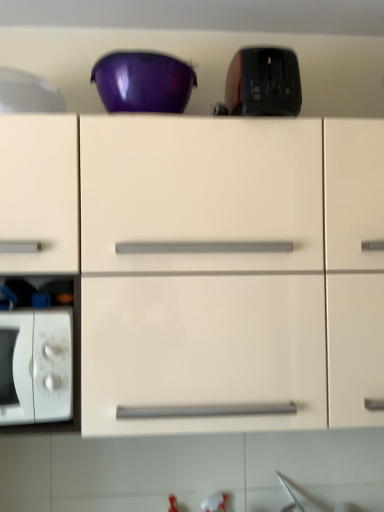
Describe the element at coordinates (230, 273) in the screenshot. I see `matte white cabinet at center` at that location.

Image resolution: width=384 pixels, height=512 pixels. What do you see at coordinates (143, 82) in the screenshot?
I see `glossy plastic bowl at upper center` at bounding box center [143, 82].

This screenshot has height=512, width=384. I want to click on white matte microwave oven at lower left, so coord(40,366).

At what (x,y) coordinates should I click in order to perform the action: click on black glossy toaster at upper center, the second appliance positioned from the left. Please return your answer as a coordinate pair (x, y). This screenshot has height=512, width=384. Looking at the image, I should click on (263, 83).

Is glossy plastic bowl at upper center at the back of black glossy toaster at upper center, which is the first appliance in right-to-left order?

No.

Considering the sizes of objects black glossy toaster at upper center, which is the first appliance in right-to-left order, and glossy plastic bowl at upper center in the image provided, who is wider, black glossy toaster at upper center, which is the first appliance in right-to-left order, or glossy plastic bowl at upper center?

glossy plastic bowl at upper center is wider.

Considering the sizes of objects black glossy toaster at upper center, the second appliance positioned from the left, and glossy plastic bowl at upper center in the image provided, who is taller, black glossy toaster at upper center, the second appliance positioned from the left, or glossy plastic bowl at upper center?

black glossy toaster at upper center, the second appliance positioned from the left, is taller.

Does black glossy toaster at upper center, the second appliance positioned from the left, lie behind glossy plastic bowl at upper center?

No, black glossy toaster at upper center, the second appliance positioned from the left, is closer to the viewer.

Is glossy plastic bowl at upper center positioned before matte white cabinet at center?

No, it is not.

Where is `bowl lying behind the matte white cabinet at center`? The height and width of the screenshot is (512, 384). bowl lying behind the matte white cabinet at center is located at coordinates (143, 82).

Is glossy plastic bowl at upper center directly adjacent to matte white cabinet at center?

No, glossy plastic bowl at upper center is not next to matte white cabinet at center.

Is matte white cabinet at center next to white matte microwave oven at lower left?

They are not placed beside each other.

Who is smaller, matte white cabinet at center or white matte microwave oven at lower left?

white matte microwave oven at lower left.

In the scene shown: Can you confirm if matte white cabinet at center is wider than white matte microwave oven at lower left?

Correct, the width of matte white cabinet at center exceeds that of white matte microwave oven at lower left.

Is matte white cabinet at center further to camera compared to white matte microwave oven at lower left?

No.

From a real-world perspective, is white glossy microwave at left, marked as the first appliance in a left-to-right arrangement, physically below glossy plastic bowl at upper center?

Actually, white glossy microwave at left, marked as the first appliance in a left-to-right arrangement, is physically above glossy plastic bowl at upper center in the real world.

The image size is (384, 512). In order to click on appliance above the glossy plastic bowl at upper center (from a real-world perspective) in this screenshot , I will do `click(28, 93)`.

Is the depth of white glossy microwave at left, marked as the first appliance in a left-to-right arrangement, greater than that of glossy plastic bowl at upper center?

Yes, white glossy microwave at left, marked as the first appliance in a left-to-right arrangement, is further from the camera.

Does point (56, 111) come farther from viewer compared to point (153, 67)?

No, (56, 111) is closer to viewer.

Identify the location of microwave oven located on the left of black glossy toaster at upper center, the second appliance positioned from the left. Image resolution: width=384 pixels, height=512 pixels. click(40, 366).

From a real-world perspective, is black glossy toaster at upper center, the second appliance positioned from the left, beneath white matte microwave oven at lower left?

Actually, black glossy toaster at upper center, the second appliance positioned from the left, is physically above white matte microwave oven at lower left in the real world.

Could you tell me if black glossy toaster at upper center, which is the first appliance in right-to-left order, is facing white matte microwave oven at lower left?

No, black glossy toaster at upper center, which is the first appliance in right-to-left order, is not facing towards white matte microwave oven at lower left.

Is black glossy toaster at upper center, which is the first appliance in right-to-left order, in front of or behind white matte microwave oven at lower left in the image?

In the image, black glossy toaster at upper center, which is the first appliance in right-to-left order, appears behind white matte microwave oven at lower left.

I want to click on cabinetry lying in front of the white matte microwave oven at lower left, so click(x=230, y=273).

In the scene shown: Could you tell me if white matte microwave oven at lower left is turned towards matte white cabinet at center?

Yes, white matte microwave oven at lower left is facing matte white cabinet at center.

In the scene shown: Which point is more distant from viewer, (57, 328) or (120, 328)?

Point (120, 328)

Are white matte microwave oven at lower left and matte white cabinet at center located far from each other?

No, there isn't a large distance between white matte microwave oven at lower left and matte white cabinet at center.

From a real-world perspective, does black glossy toaster at upper center, the second appliance positioned from the left, sit lower than matte white cabinet at center?

No, from a real-world perspective, black glossy toaster at upper center, the second appliance positioned from the left, is not below matte white cabinet at center.

Which object is further away from the camera, black glossy toaster at upper center, the second appliance positioned from the left, or matte white cabinet at center?

black glossy toaster at upper center, the second appliance positioned from the left, is further away from the camera.

Is black glossy toaster at upper center, the second appliance positioned from the left, located outside matte white cabinet at center?

Yes.

Is black glossy toaster at upper center, the second appliance positioned from the left, not near matte white cabinet at center?

black glossy toaster at upper center, the second appliance positioned from the left, is actually quite close to matte white cabinet at center.

Find the location of a particular element. The image size is (384, 512). bowl above the black glossy toaster at upper center, which is the first appliance in right-to-left order (from a real-world perspective) is located at coordinates (143, 82).

Find the location of a particular element. bowl located behind the matte white cabinet at center is located at coordinates (143, 82).

Based on their spatial positions, is matte white cabinet at center or white matte microwave oven at lower left closer to black glossy toaster at upper center, which is the first appliance in right-to-left order?

matte white cabinet at center is closer to black glossy toaster at upper center, which is the first appliance in right-to-left order.

Based on the photo, based on their spatial positions, is white glossy microwave at left, marked as the first appliance in a left-to-right arrangement, or matte white cabinet at center closer to glossy plastic bowl at upper center?

white glossy microwave at left, marked as the first appliance in a left-to-right arrangement.

From the image, which object appears to be farther from white glossy microwave at left, which is the 2th appliance from right to left, black glossy toaster at upper center, which is the first appliance in right-to-left order, or glossy plastic bowl at upper center?

Based on the image, black glossy toaster at upper center, which is the first appliance in right-to-left order, appears to be further to white glossy microwave at left, which is the 2th appliance from right to left.

Based on their spatial positions, is white glossy microwave at left, which is the 2th appliance from right to left, or matte white cabinet at center closer to white matte microwave oven at lower left?

matte white cabinet at center lies closer to white matte microwave oven at lower left than the other object.

Considering their positions, is white glossy microwave at left, which is the 2th appliance from right to left, positioned further to matte white cabinet at center than glossy plastic bowl at upper center?

Based on the image, white glossy microwave at left, which is the 2th appliance from right to left, appears to be further to matte white cabinet at center.

When comparing their distances from glossy plastic bowl at upper center, does black glossy toaster at upper center, the second appliance positioned from the left, or white glossy microwave at left, marked as the first appliance in a left-to-right arrangement, seem further?

The object further to glossy plastic bowl at upper center is black glossy toaster at upper center, the second appliance positioned from the left.

Which object lies further to the anchor point matte white cabinet at center, white matte microwave oven at lower left or black glossy toaster at upper center, which is the first appliance in right-to-left order?

black glossy toaster at upper center, which is the first appliance in right-to-left order, is further to matte white cabinet at center.

From the image, which object appears to be nearer to black glossy toaster at upper center, the second appliance positioned from the left, glossy plastic bowl at upper center or white glossy microwave at left, marked as the first appliance in a left-to-right arrangement?

glossy plastic bowl at upper center.

Identify the location of appliance between black glossy toaster at upper center, which is the first appliance in right-to-left order, and white matte microwave oven at lower left, in the vertical direction. (x=28, y=93).

Where is `bowl located between white glossy microwave at left, marked as the first appliance in a left-to-right arrangement, and black glossy toaster at upper center, the second appliance positioned from the left, in the left-right direction`? The height and width of the screenshot is (512, 384). bowl located between white glossy microwave at left, marked as the first appliance in a left-to-right arrangement, and black glossy toaster at upper center, the second appliance positioned from the left, in the left-right direction is located at coordinates (143, 82).

Identify the location of cabinetry between glossy plastic bowl at upper center and white matte microwave oven at lower left vertically. (230, 273).

Locate an element on the screen. The height and width of the screenshot is (512, 384). cabinetry between white glossy microwave at left, marked as the first appliance in a left-to-right arrangement, and black glossy toaster at upper center, the second appliance positioned from the left, from left to right is located at coordinates (230, 273).